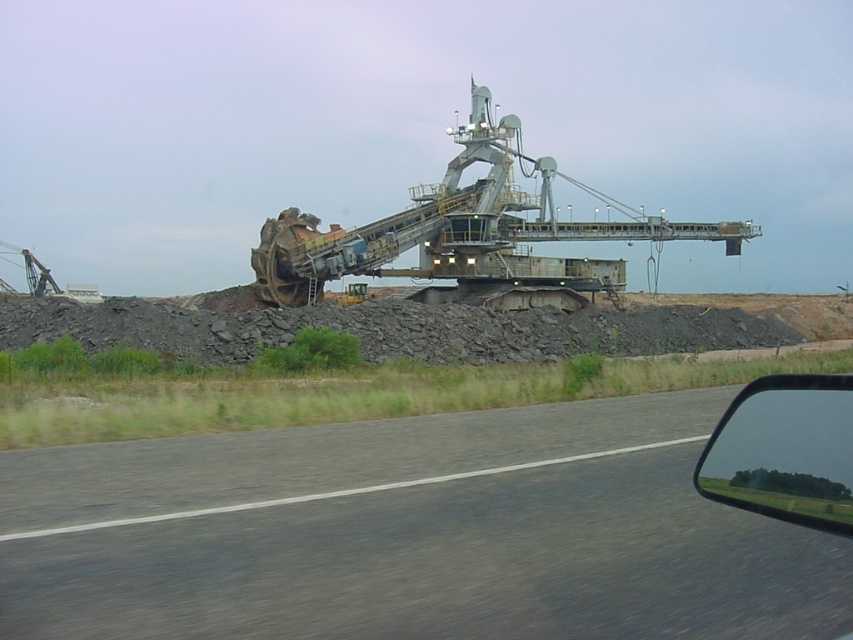
Question: Which of the following is the closest to the observer?

Choices:
 (A) gray asphalt road at center
 (B) transparent glass car window at lower right
 (C) rusty metal bucket at center

Answer: (B)

Question: Which point is farther from the camera taking this photo?

Choices:
 (A) (169, 552)
 (B) (312, 262)

Answer: (B)

Question: From the image, what is the correct spatial relationship of gray asphalt road at center in relation to transparent glass car window at lower right?

Choices:
 (A) left
 (B) right

Answer: (A)

Question: Considering the relative positions of rusty metal bucket at center and transparent glass car window at lower right in the image provided, where is rusty metal bucket at center located with respect to transparent glass car window at lower right?

Choices:
 (A) right
 (B) left

Answer: (A)

Question: Which of the following is the farthest from the observer?

Choices:
 (A) [740, 451]
 (B) [434, 193]
 (C) [695, 547]

Answer: (B)

Question: In this image, where is gray asphalt road at center located relative to rusty metal bucket at center?

Choices:
 (A) below
 (B) above

Answer: (A)